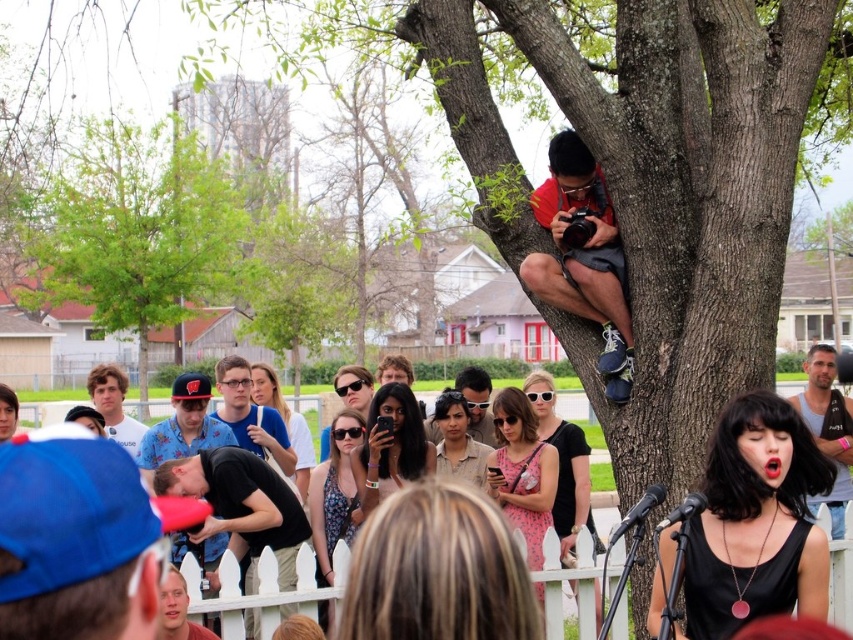
Does black matte shirt at lower left have a larger size compared to matte blue cap at center?

No.

Who is more distant from viewer, (227, 524) or (289, 470)?

Positioned behind is point (289, 470).

Where is `black matte shirt at lower left`? Image resolution: width=853 pixels, height=640 pixels. black matte shirt at lower left is located at coordinates (241, 506).

Between point (592, 227) and point (808, 360), which one is positioned in front?

Point (592, 227)

How distant is red fabric camera at upper center from gray tank top at right?

A distance of 4.56 meters exists between red fabric camera at upper center and gray tank top at right.

This screenshot has height=640, width=853. What do you see at coordinates (583, 257) in the screenshot?
I see `red fabric camera at upper center` at bounding box center [583, 257].

At what (x,y) coordinates should I click in order to perform the action: click on red fabric camera at upper center. Please return your answer as a coordinate pair (x, y). Looking at the image, I should click on (583, 257).

Who is positioned more to the right, blue fabric cap at lower left or matte black sunglasses at center?

blue fabric cap at lower left

What do you see at coordinates (74, 540) in the screenshot? This screenshot has height=640, width=853. I see `blue fabric cap at lower left` at bounding box center [74, 540].

The image size is (853, 640). What do you see at coordinates (74, 540) in the screenshot?
I see `blue fabric cap at lower left` at bounding box center [74, 540].

Identify the location of blue fabric cap at lower left. (74, 540).